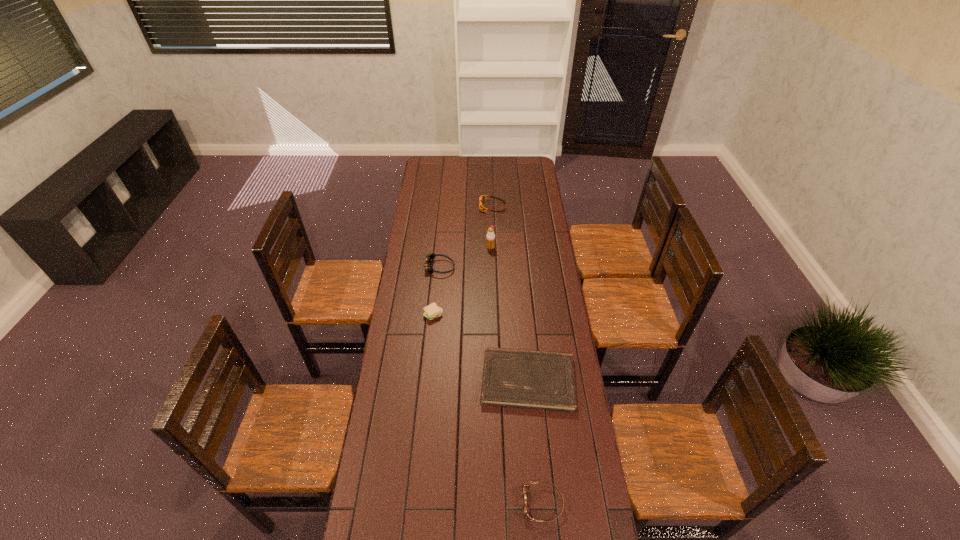
At what (x,y) coordinates should I click in order to perform the action: click on free region located 0.320m through the lenses of the third farthest object. Please return your answer as a coordinate pair (x, y). Image resolution: width=960 pixels, height=540 pixels. Looking at the image, I should click on (520, 267).

You are a GUI agent. You are given a task and a screenshot of the screen. Output one action in this format:
    pyautogui.click(x=<x>, y=<y>)
    Task: Click on the vacant space located with the lenses facing forward on the farthest object
    This screenshot has height=540, width=960.
    Given the screenshot: What is the action you would take?
    pyautogui.click(x=422, y=207)

Locate an element on the screen. The width and height of the screenshot is (960, 540). vacant area situated with the lenses facing forward on the farthest object is located at coordinates (416, 207).

Find the location of a particular element. This screenshot has width=960, height=540. vacant point located 0.090m with the lenses facing forward on the farthest object is located at coordinates pyautogui.click(x=464, y=207).

Where is `vacant space located 0.130m on the front of the fourth farthest object`? vacant space located 0.130m on the front of the fourth farthest object is located at coordinates (430, 347).

The width and height of the screenshot is (960, 540). What are the coordinates of `vacant space situated through the lenses of the nearest object` in the screenshot? It's located at (440, 504).

The height and width of the screenshot is (540, 960). What are the coordinates of `vacant space located through the lenses of the nearest object` in the screenshot? It's located at (475, 504).

Where is `free spot located 0.390m through the lenses of the nearest object`? The width and height of the screenshot is (960, 540). free spot located 0.390m through the lenses of the nearest object is located at coordinates (398, 504).

Image resolution: width=960 pixels, height=540 pixels. Find the location of `vacant area situated on the back of the paperback book`. vacant area situated on the back of the paperback book is located at coordinates (521, 308).

Identify the location of goggles that is positioned at the left edge. The image size is (960, 540). (429, 258).